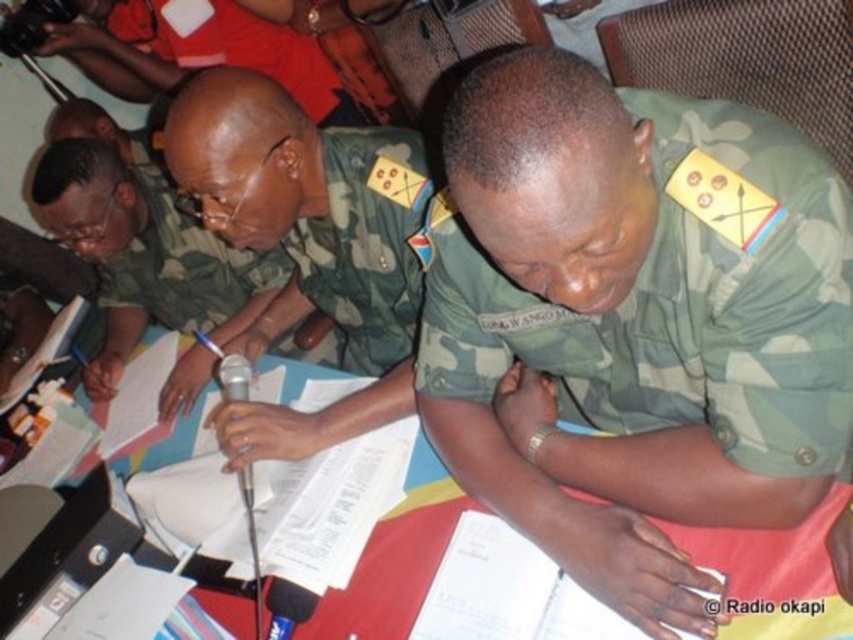
You are a drone operator controlling a drone that is flying above the military personnel. You need to determine if the point at coordinate point (357, 148) is closer to you than point (247, 467). Based on the scene, what is your conclusion?

Point (357, 148) is further to the viewer than point (247, 467), so the point at coordinate point (357, 148) is not closer to you than point (247, 467).

You are a photographer positioned behind the group. You need to take a photo that includes both the camouflage fabric uniform at center and the metallic silver microphone at center. Which object should you ensure is positioned to the left in the frame to include both in the shot?

To include both the camouflage fabric uniform at center and the metallic silver microphone at center in the photo, you should position the metallic silver microphone at center to the left since the camouflage fabric uniform at center is to the right of it.

You are a drone operator controlling a drone that is 1.2 meters wide. You need to fly the drone through the space between the camouflage fabric uniform at center and the nearest wall. Is there enough space for the drone to pass through?

The distance between the camouflage fabric uniform at center and the viewer is 1.11 meters. Since the drone is 1.2 meters wide, it is slightly wider than the available space, so the drone cannot pass through.